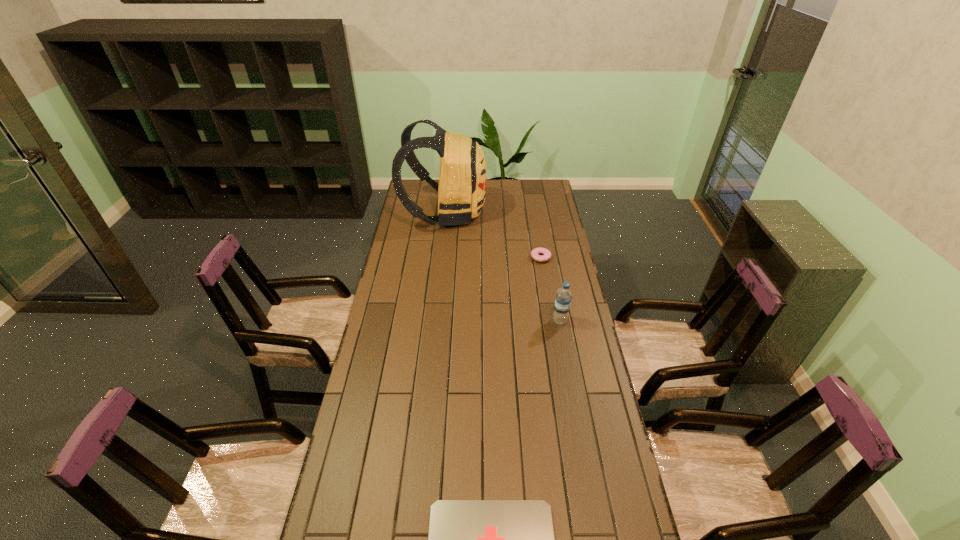
The height and width of the screenshot is (540, 960). I want to click on backpack, so click(461, 189).

At what (x,y) coordinates should I click in order to perform the action: click on the farthest object. Please return your answer as a coordinate pair (x, y). Looking at the image, I should click on (461, 189).

Where is `the second nearest object`? The width and height of the screenshot is (960, 540). the second nearest object is located at coordinates (563, 299).

What are the coordinates of `water bottle` in the screenshot? It's located at (563, 299).

Where is `the third nearest object`? Image resolution: width=960 pixels, height=540 pixels. the third nearest object is located at coordinates (545, 256).

Identify the location of the second shortest object. The image size is (960, 540). (545, 256).

Identify the location of vacant space located on the front-facing side of the backpack. This screenshot has width=960, height=540. (535, 213).

At what (x,y) coordinates should I click in order to perform the action: click on vacant space situated on the label of the third shortest object. Please return your answer as a coordinate pair (x, y). The height and width of the screenshot is (540, 960). Looking at the image, I should click on (513, 320).

You are a GUI agent. You are given a task and a screenshot of the screen. Output one action in this format:
    pyautogui.click(x=<x>, y=<y>)
    Task: Click on the free space located on the label of the third shortest object
    The height and width of the screenshot is (540, 960).
    Given the screenshot: What is the action you would take?
    pyautogui.click(x=516, y=320)

Image resolution: width=960 pixels, height=540 pixels. Identify the location of free point located on the label of the third shortest object. (453, 320).